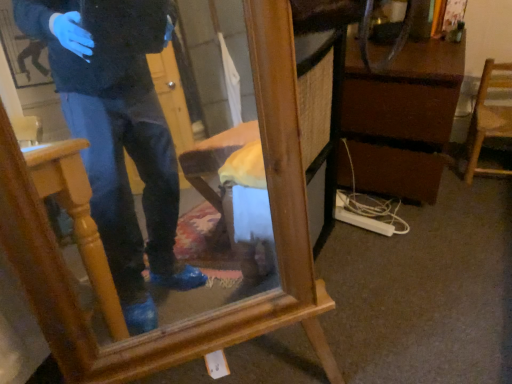
Locate an element on the screen. The width and height of the screenshot is (512, 384). vacant space that is to the left of wooden chair at right is located at coordinates (455, 180).